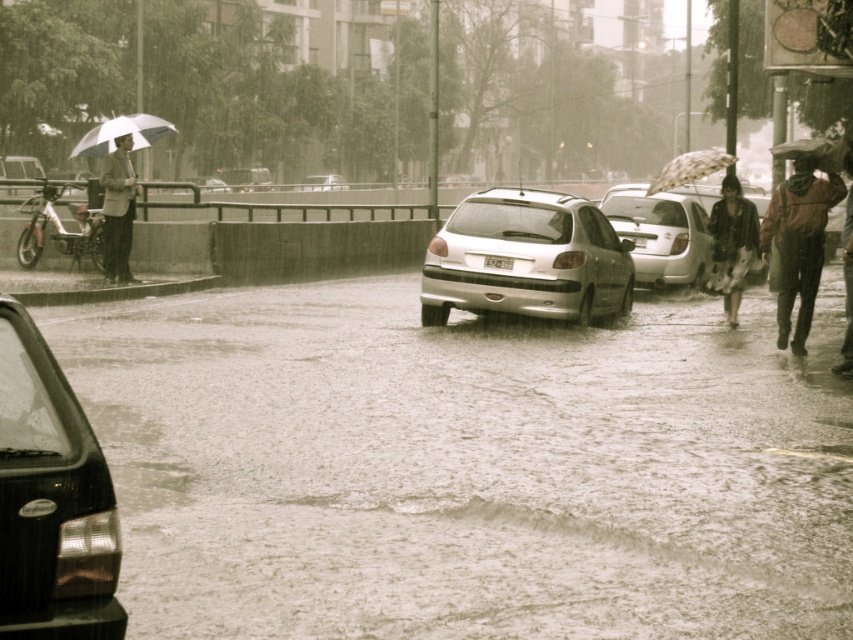
Question: Which point is closer to the camera taking this photo?

Choices:
 (A) (805, 150)
 (B) (775, 218)

Answer: (A)

Question: Is floral dress at lower right behind transparent plastic umbrella at upper right?

Choices:
 (A) yes
 (B) no

Answer: (A)

Question: Does satin silver hatchback at center appear over metallic silver sedan at center?

Choices:
 (A) no
 (B) yes

Answer: (A)

Question: Which is nearer to the transparent plastic umbrella at upper right?

Choices:
 (A) frothy water at center
 (B) matte black jacket at left
 (C) satin silver hatchback at center

Answer: (C)

Question: Does matte black jacket at left have a lesser width compared to transparent fabric umbrella at upper right?

Choices:
 (A) no
 (B) yes

Answer: (B)

Question: Which of the following is the farthest from the observer?

Choices:
 (A) transparent fabric umbrella at upper right
 (B) white matte umbrella at left

Answer: (B)